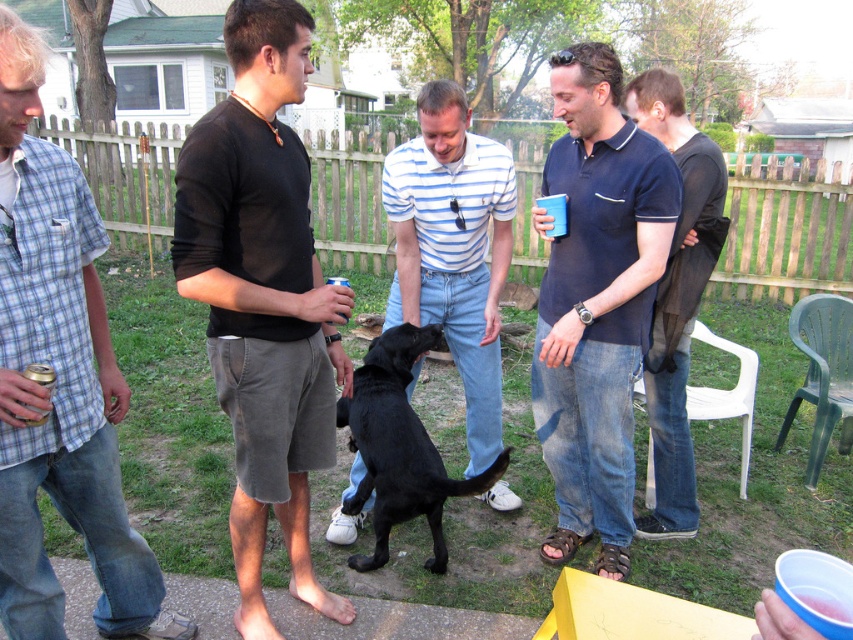
You are planning to place a small decorative item between the dark blue polo shirt at center and the blue plastic cup at center. Given that the item is 24 inches long, will it fit in the space between them?

The distance between the dark blue polo shirt at center and the blue plastic cup at center is 26.85 inches, so the 24 inch decorative item will fit as it is shorter than the available space.

What object is located at the coordinates point (263, 298) in the image?

The coordinates point (263, 298) correspond to the black matte shorts at center.